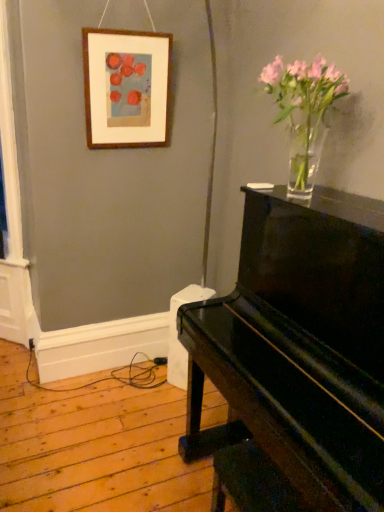
Question: Could you tell me if glossy black piano at right is facing wooden picture frame at upper left?

Choices:
 (A) yes
 (B) no

Answer: (B)

Question: From the image's perspective, is glossy black piano at right on wooden picture frame at upper left?

Choices:
 (A) no
 (B) yes

Answer: (A)

Question: Considering the relative sizes of glossy black piano at right and wooden picture frame at upper left in the image provided, is glossy black piano at right thinner than wooden picture frame at upper left?

Choices:
 (A) yes
 (B) no

Answer: (B)

Question: From the image's perspective, is glossy black piano at right below wooden picture frame at upper left?

Choices:
 (A) no
 (B) yes

Answer: (B)

Question: Can wooden picture frame at upper left be found inside glossy black piano at right?

Choices:
 (A) no
 (B) yes

Answer: (A)

Question: Is point (324, 124) positioned closer to the camera than point (152, 77)?

Choices:
 (A) closer
 (B) farther

Answer: (A)

Question: From the image's perspective, is clear glass vase at upper right above or below wooden picture frame at upper left?

Choices:
 (A) above
 (B) below

Answer: (B)

Question: Based on their positions, is clear glass vase at upper right located to the left or right of wooden picture frame at upper left?

Choices:
 (A) right
 (B) left

Answer: (A)

Question: From a real-world perspective, is clear glass vase at upper right physically located above or below wooden picture frame at upper left?

Choices:
 (A) below
 (B) above

Answer: (A)

Question: Relative to clear glass vase at upper right, is glossy black piano at right in front or behind?

Choices:
 (A) front
 (B) behind

Answer: (A)

Question: Considering the positions of point (306, 415) and point (297, 130), is point (306, 415) closer or farther from the camera than point (297, 130)?

Choices:
 (A) farther
 (B) closer

Answer: (B)

Question: Looking at their shapes, would you say glossy black piano at right is wider or thinner than clear glass vase at upper right?

Choices:
 (A) wide
 (B) thin

Answer: (A)

Question: Visually, is glossy black piano at right positioned to the left or to the right of clear glass vase at upper right?

Choices:
 (A) right
 (B) left

Answer: (A)

Question: Visually, is glossy black piano at right positioned to the left or to the right of wooden picture frame at upper left?

Choices:
 (A) left
 (B) right

Answer: (B)

Question: Does point (339, 294) appear closer or farther from the camera than point (102, 66)?

Choices:
 (A) farther
 (B) closer

Answer: (B)